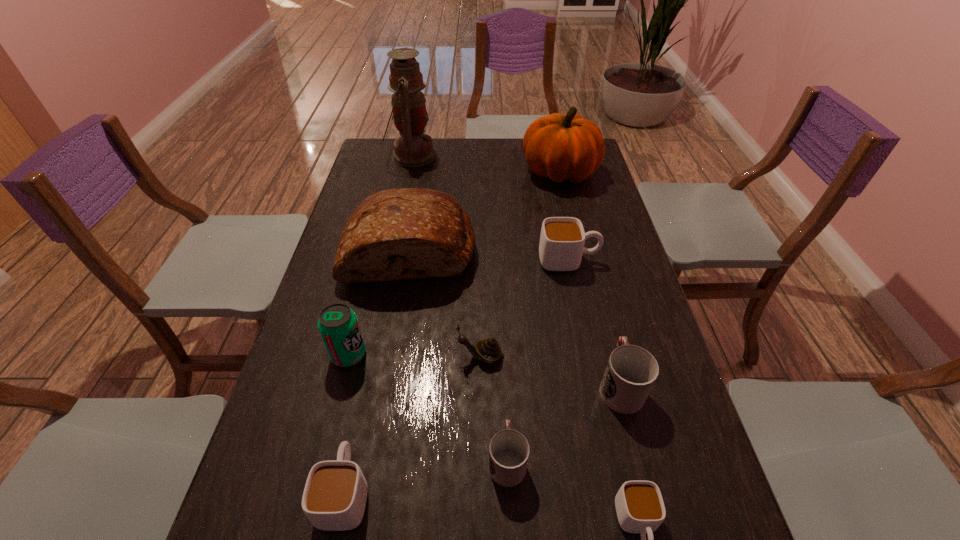
At what (x,y) coordinates should I click in order to perform the action: click on snail. Please return your answer as a coordinate pair (x, y). The height and width of the screenshot is (540, 960). Looking at the image, I should click on (488, 350).

At what (x,y) coordinates should I click in order to perform the action: click on the second smallest white cup. Please return your answer as a coordinate pair (x, y). Image resolution: width=960 pixels, height=540 pixels. Looking at the image, I should click on (334, 498).

In order to click on the leftmost cup in this screenshot , I will do [334, 498].

The width and height of the screenshot is (960, 540). I want to click on the smaller red cup, so click(509, 450).

Image resolution: width=960 pixels, height=540 pixels. In order to click on the left red cup in this screenshot , I will do `click(509, 450)`.

Identify the location of vacant space located 0.370m on the right of the red oil lamp. (530, 156).

Where is `vacant space located 0.340m on the front of the orange pumpkin`? vacant space located 0.340m on the front of the orange pumpkin is located at coordinates (580, 258).

Identify the location of free point located 0.170m at the sliced front of the bread. click(395, 338).

What are the coordinates of `free space located on the front-facing side of the seventh shortest object` in the screenshot? It's located at (436, 355).

Where is `vacant space located on the side with the handle of the farthest white cup`? vacant space located on the side with the handle of the farthest white cup is located at coordinates click(622, 260).